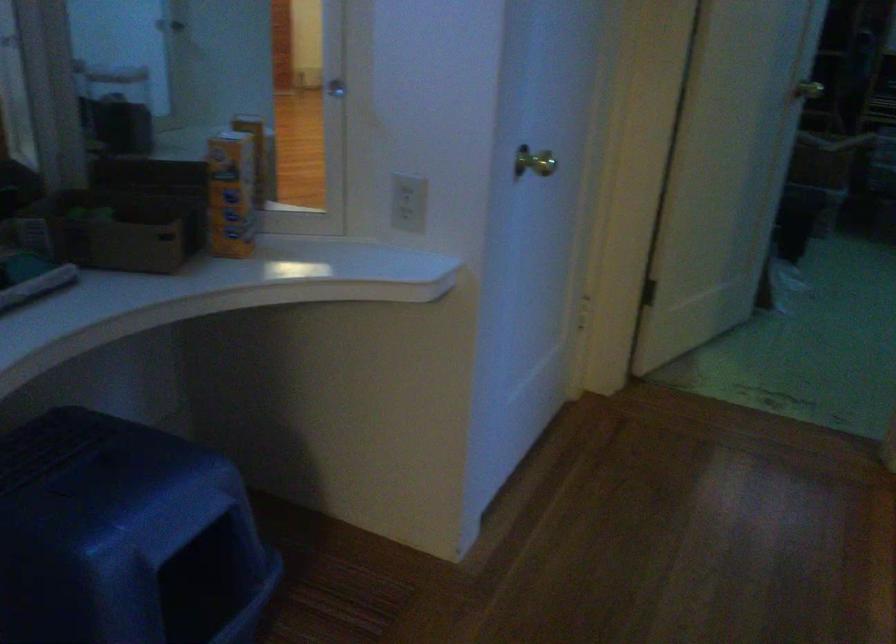
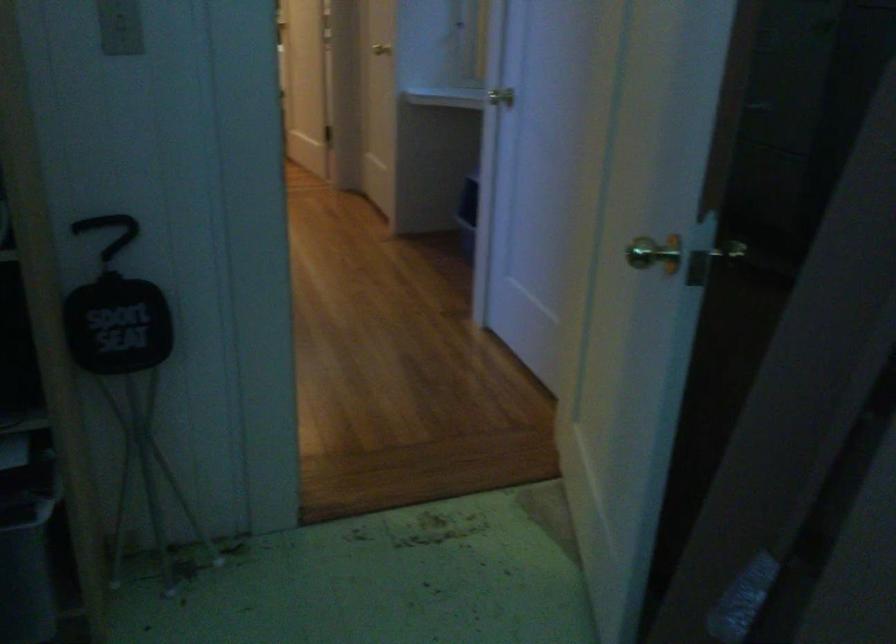
Question: I am providing you with two images of the same scene from different viewpoints. Please identify which objects are invisible in image2.

Choices:
 (A) light switch
 (B) white electrical outlet
 (C) brass door handle
 (D) trash can lid handle

Answer: (B)